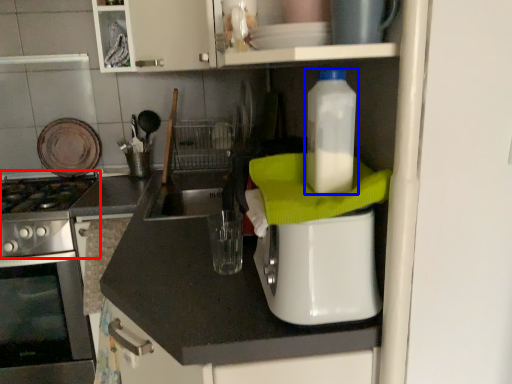
Question: Which object is further to the camera taking this photo, gas stove (highlighted by a red box) or bottle (highlighted by a blue box)?

Choices:
 (A) gas stove
 (B) bottle

Answer: (A)